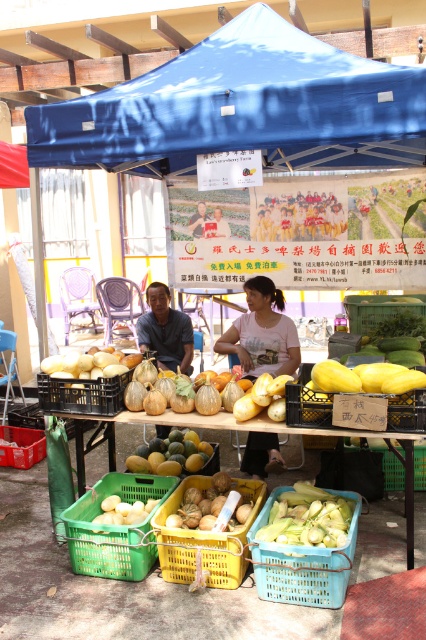
Who is more distant from viewer, (298,380) or (400,468)?

The point (400,468) is behind.

The image size is (426, 640). What do you see at coordinates (307, 403) in the screenshot?
I see `yellow matte melon basket at center` at bounding box center [307, 403].

The width and height of the screenshot is (426, 640). In order to click on yellow matte melon basket at center in this screenshot , I will do `click(307, 403)`.

Who is positioned more to the left, translucent plastic basket at lower center or matte brown shirt at center?

Positioned to the left is matte brown shirt at center.

Between translucent plastic basket at lower center and matte brown shirt at center, which one appears on the right side from the viewer's perspective?

translucent plastic basket at lower center is more to the right.

This screenshot has width=426, height=640. Describe the element at coordinates (302, 563) in the screenshot. I see `translucent plastic basket at lower center` at that location.

At what (x,y) coordinates should I click in order to perform the action: click on translucent plastic basket at lower center. Please return your answer as a coordinate pair (x, y). Looking at the image, I should click on (302, 563).

This screenshot has height=640, width=426. What do you see at coordinates (169, 422) in the screenshot?
I see `plastic crates at center` at bounding box center [169, 422].

Can you confirm if plastic crates at center is positioned to the left of green matte melon at center?

Incorrect, plastic crates at center is not on the left side of green matte melon at center.

Is point (411, 550) positioned before point (207, 460)?

Yes, point (411, 550) is in front of point (207, 460).

What are the coordinates of `plastic crates at center` in the screenshot? It's located at (169, 422).